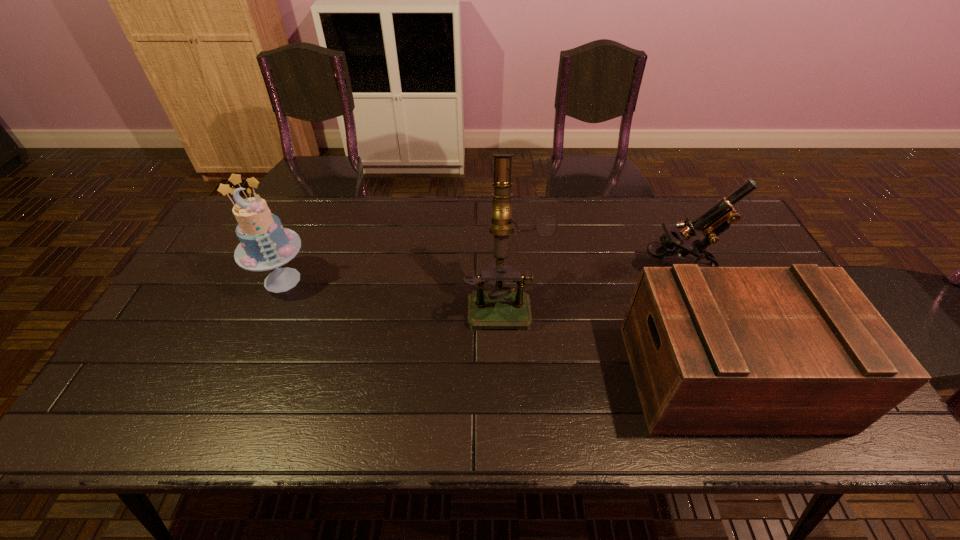
The image size is (960, 540). I want to click on blank area in the image that satisfies the following two spatial constraints: 1. through the eyepiece of the right microscope; 2. at the eyepiece of the left microscope, so click(x=691, y=300).

Find the location of a particular element. This screenshot has height=540, width=960. free space that satisfies the following two spatial constraints: 1. through the eyepiece of the shorter microscope; 2. on the left side of the box is located at coordinates (725, 376).

The width and height of the screenshot is (960, 540). I want to click on vacant region that satisfies the following two spatial constraints: 1. through the eyepiece of the box; 2. on the right side of the right microscope, so click(725, 376).

Identify the location of free space in the image that satisfies the following two spatial constraints: 1. through the eyepiece of the shorter microscope; 2. with a ladder on the side of the cake. (683, 280).

Find the location of `free location that satisfies the following two spatial constraints: 1. through the eyepiece of the right microscope; 2. at the eyepiece of the left microscope`. free location that satisfies the following two spatial constraints: 1. through the eyepiece of the right microscope; 2. at the eyepiece of the left microscope is located at coordinates (691, 300).

Where is `blank area in the image that satisfies the following two spatial constraints: 1. through the eyepiece of the shorter microscope; 2. at the eyepiece of the left microscope`? The image size is (960, 540). blank area in the image that satisfies the following two spatial constraints: 1. through the eyepiece of the shorter microscope; 2. at the eyepiece of the left microscope is located at coordinates (691, 300).

Find the location of a particular element. The image size is (960, 540). free space that satisfies the following two spatial constraints: 1. at the eyepiece of the box; 2. on the right side of the tallest object is located at coordinates (x=509, y=376).